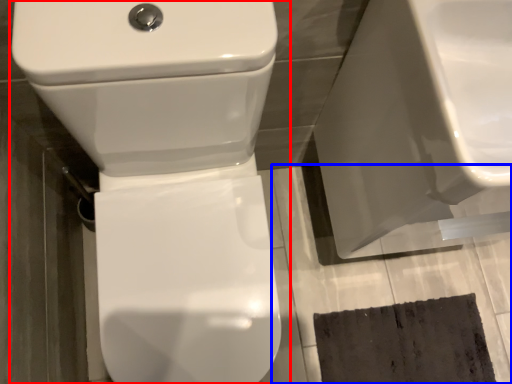
Question: Which object is closer to the camera taking this photo, toilet (highlighted by a red box) or concrete (highlighted by a blue box)?

Choices:
 (A) toilet
 (B) concrete

Answer: (A)